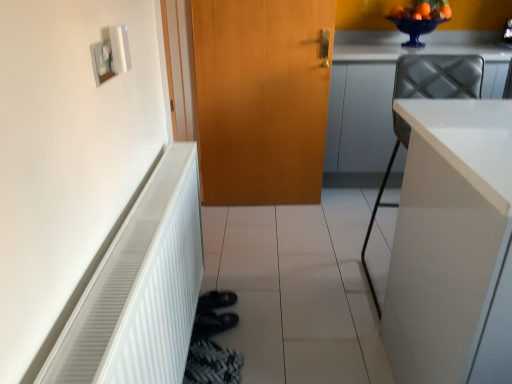
Question: Is white plastic light switch at upper left positioned before white glossy cabinet at upper right, marked as the 1th cabinetry in a back-to-front arrangement?

Choices:
 (A) yes
 (B) no

Answer: (A)

Question: Is white plastic light switch at upper left thinner than white glossy cabinet at upper right, marked as the 1th cabinetry in a back-to-front arrangement?

Choices:
 (A) yes
 (B) no

Answer: (A)

Question: Considering the relative sizes of white plastic light switch at upper left and white glossy cabinet at upper right, marked as the 1th cabinetry in a back-to-front arrangement, in the image provided, is white plastic light switch at upper left bigger than white glossy cabinet at upper right, marked as the 1th cabinetry in a back-to-front arrangement,?

Choices:
 (A) yes
 (B) no

Answer: (B)

Question: From a real-world perspective, is white plastic light switch at upper left below white glossy cabinet at upper right, placed as the second cabinetry when sorted from front to back?

Choices:
 (A) no
 (B) yes

Answer: (A)

Question: Does white plastic light switch at upper left appear on the left side of white glossy cabinet at upper right, marked as the 1th cabinetry in a back-to-front arrangement?

Choices:
 (A) no
 (B) yes

Answer: (B)

Question: In terms of width, does white ribbed radiator at left look wider or thinner when compared to wooden door at center?

Choices:
 (A) thin
 (B) wide

Answer: (B)

Question: Is point (176, 301) closer or farther from the camera than point (232, 52)?

Choices:
 (A) closer
 (B) farther

Answer: (A)

Question: Considering their positions, is white ribbed radiator at left located in front of or behind wooden door at center?

Choices:
 (A) front
 (B) behind

Answer: (A)

Question: Is white ribbed radiator at left inside the boundaries of wooden door at center, or outside?

Choices:
 (A) outside
 (B) inside

Answer: (A)

Question: From the image's perspective, is white glossy cabinet at right, acting as the second cabinetry starting from the back, positioned above or below white ribbed radiator at left?

Choices:
 (A) below
 (B) above

Answer: (B)

Question: From their relative heights in the image, would you say white glossy cabinet at right, acting as the second cabinetry starting from the back, is taller or shorter than white ribbed radiator at left?

Choices:
 (A) tall
 (B) short

Answer: (A)

Question: Looking at their shapes, would you say white glossy cabinet at right, positioned as the 1th cabinetry in front-to-back order, is wider or thinner than white ribbed radiator at left?

Choices:
 (A) thin
 (B) wide

Answer: (B)

Question: Visually, is white glossy cabinet at right, acting as the second cabinetry starting from the back, positioned to the left or to the right of white ribbed radiator at left?

Choices:
 (A) left
 (B) right

Answer: (B)

Question: Is point (x=355, y=167) positioned closer to the camera than point (x=160, y=292)?

Choices:
 (A) farther
 (B) closer

Answer: (A)

Question: Based on their positions, is white glossy cabinet at upper right, placed as the second cabinetry when sorted from front to back, located to the left or right of white ribbed radiator at left?

Choices:
 (A) left
 (B) right

Answer: (B)